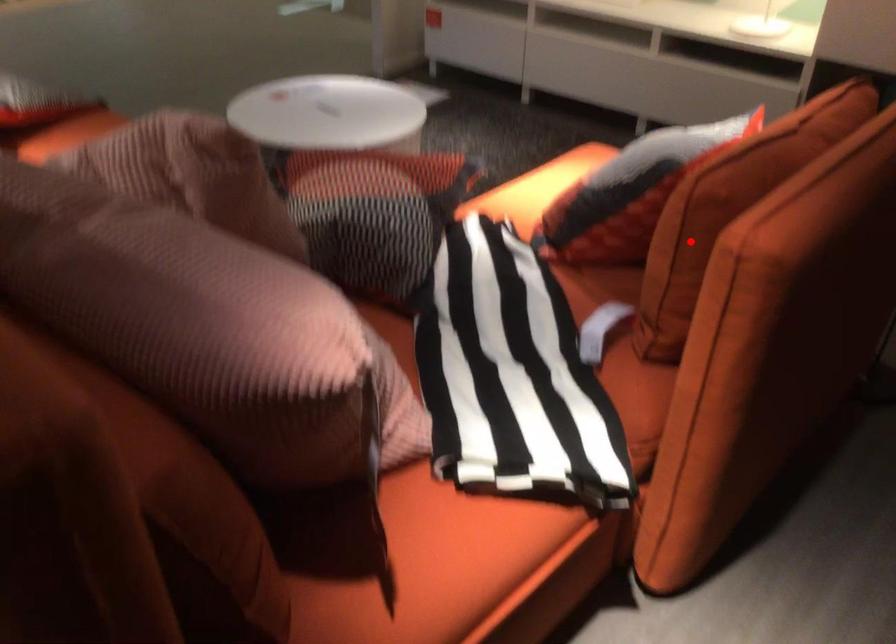
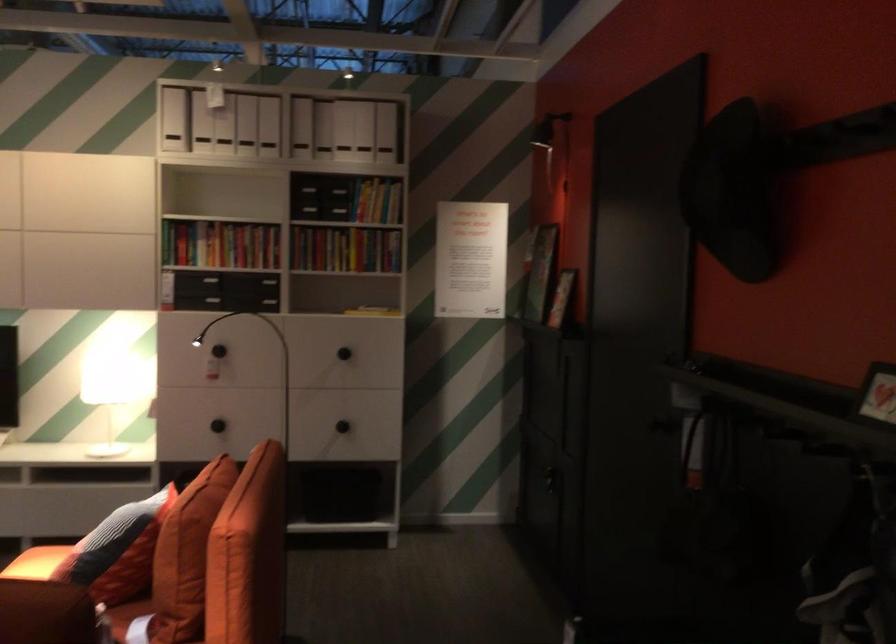
Locate, in the second image, the point that corresponds to the highlighted location in the first image.

(186, 554)